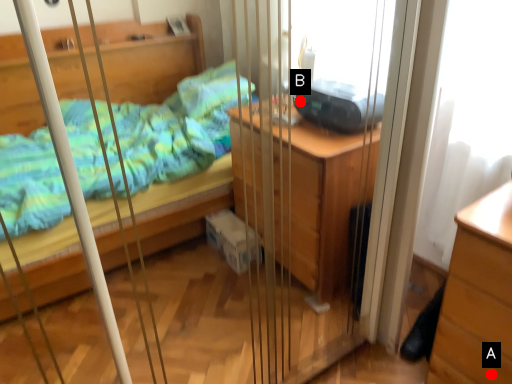
Question: Two points are circled on the image, labeled by A and B beside each circle. Among these points, which one is nearest to the camera?

Choices:
 (A) A is closer
 (B) B is closer

Answer: (A)